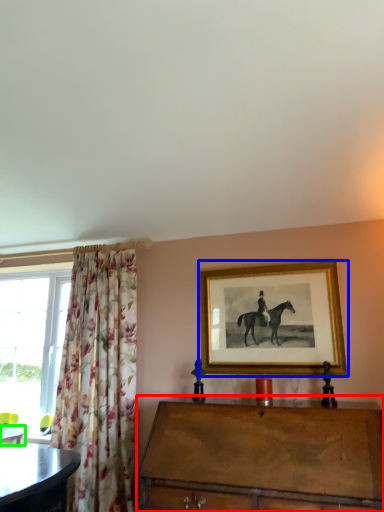
Question: Which is nearer to the chest of drawers (highlighted by a red box)? picture frame (highlighted by a blue box) or desk (highlighted by a green box).

Choices:
 (A) picture frame
 (B) desk

Answer: (A)